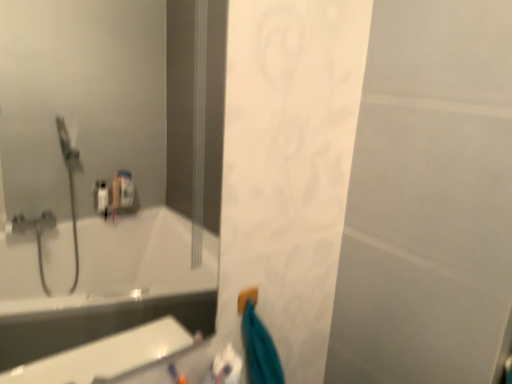
Find the location of a particular element. transparent glass mirror at upper center is located at coordinates (108, 168).

What do you see at coordinates (108, 168) in the screenshot?
I see `transparent glass mirror at upper center` at bounding box center [108, 168].

In order to click on transparent glass mirror at upper center in this screenshot , I will do (x=108, y=168).